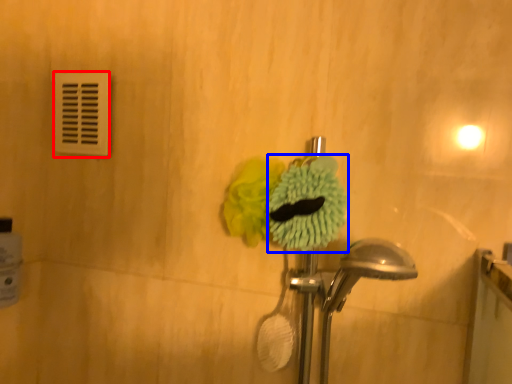
Question: Which of the following is the closest to the observer, light switch (highlighted by a red box) or flower (highlighted by a blue box)?

Choices:
 (A) light switch
 (B) flower

Answer: (B)